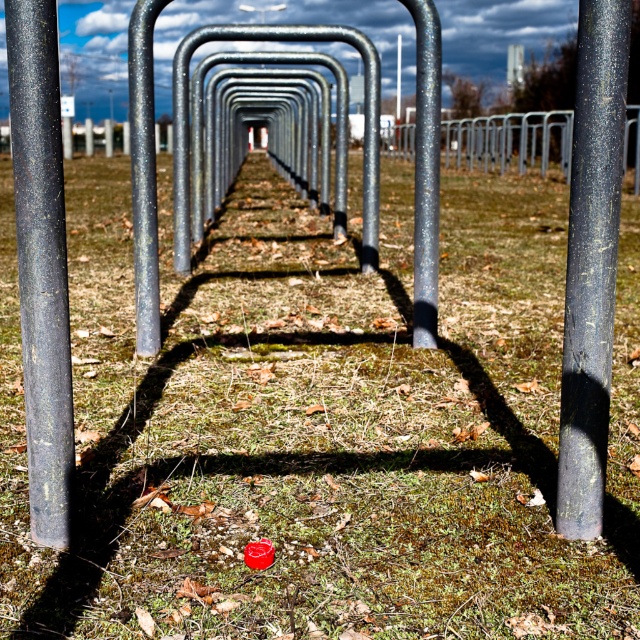
Question: Which of these objects is positioned farthest from the glossy metal pole at center?

Choices:
 (A) matte black pole at left
 (B) black matte pole at right

Answer: (B)

Question: Which of the following is the closest to the observer?

Choices:
 (A) matte black pole at left
 (B) black matte pole at right
 (C) glossy metal bike rack at center
 (D) galvanized steel pole at center

Answer: (A)

Question: Is matte black pole at left below glossy metal bike rack at center?

Choices:
 (A) no
 (B) yes

Answer: (B)

Question: Can you confirm if black matte pole at right is smaller than glossy metal pole at center?

Choices:
 (A) yes
 (B) no

Answer: (B)

Question: Is glossy metal bike rack at center bigger than glossy metal pole at center?

Choices:
 (A) yes
 (B) no

Answer: (A)

Question: Based on their relative distances, which object is nearer to the black matte pole at right?

Choices:
 (A) galvanized steel pole at center
 (B) matte black pole at left

Answer: (B)